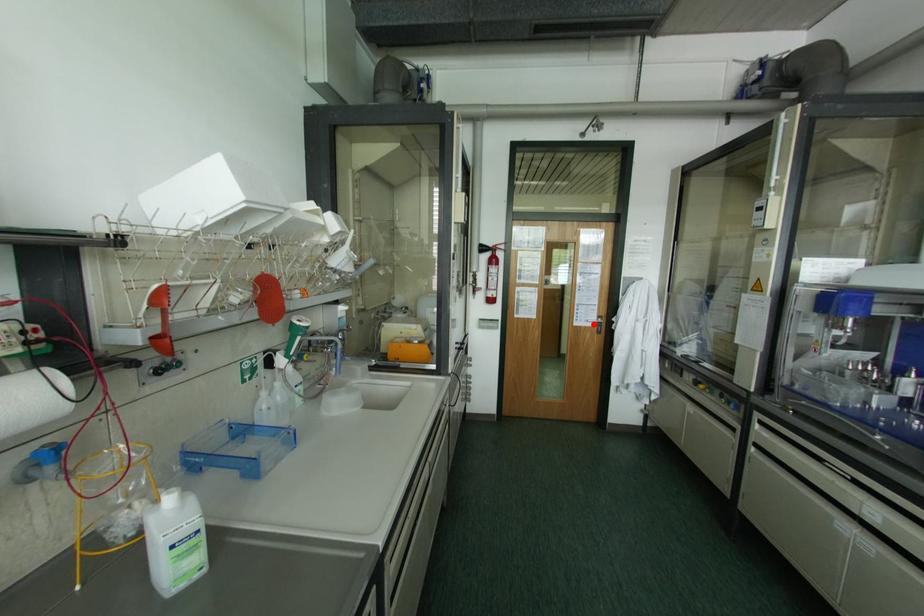
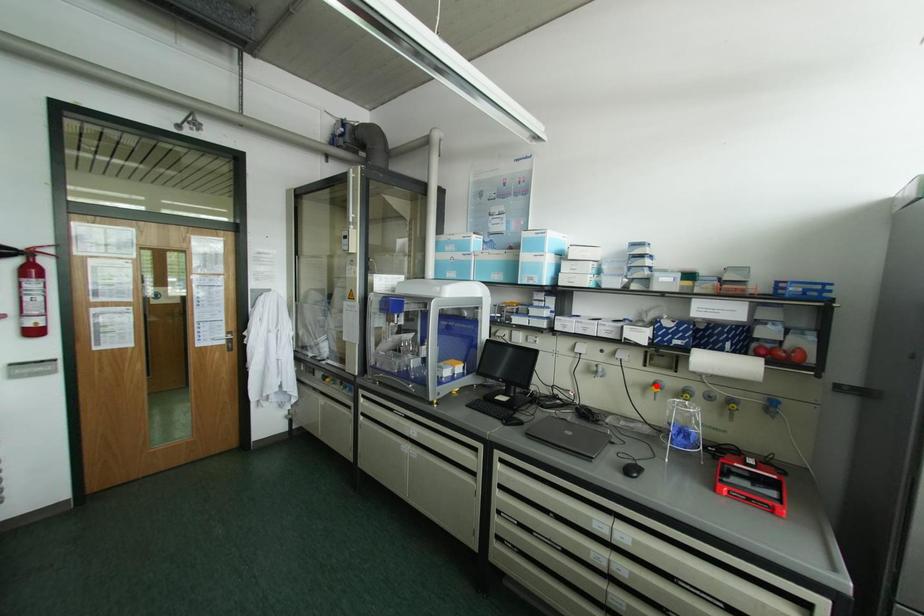
I am providing you with two images of the same scene from different viewpoints. A red point is marked on the first image and another point is marked on the second image. Does the point marked in image1 correspond to the same location as the one in image2?

No